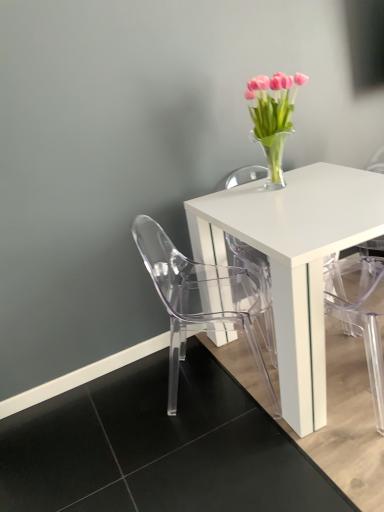
Locate an element on the screen. vacant region below transparent plastic chair at lower left (from a real-world perspective) is located at coordinates (216, 390).